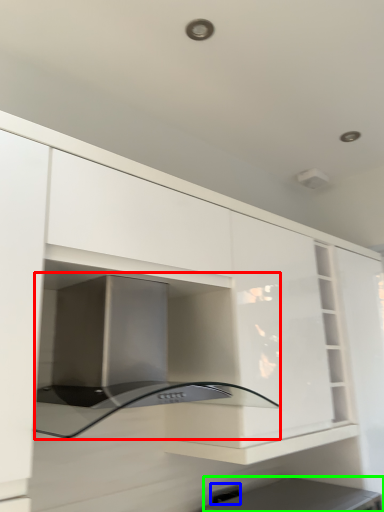
Question: Which is nearer to the oven (highlighted by a red box)? electric outlet (highlighted by a blue box) or appliance (highlighted by a green box).

Choices:
 (A) electric outlet
 (B) appliance

Answer: (B)